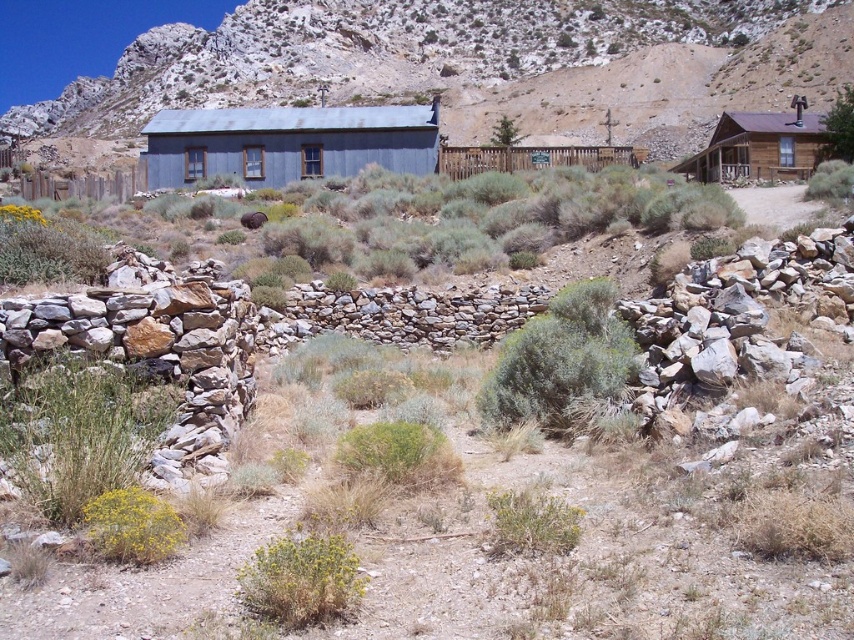
Can you confirm if brown wooden cabin at upper right is shorter than yellow-green shrub at lower left?

In fact, brown wooden cabin at upper right may be taller than yellow-green shrub at lower left.

Which is above, brown wooden cabin at upper right or yellow-green shrub at lower left?

Positioned higher is brown wooden cabin at upper right.

Is point (686, 161) less distant than point (164, 520)?

No.

Find the location of a particular element. The height and width of the screenshot is (640, 854). brown wooden cabin at upper right is located at coordinates (759, 147).

Who is positioned more to the right, green shrub at center or green leafy bush at upper right?

From the viewer's perspective, green leafy bush at upper right appears more on the right side.

Is green shrub at center positioned before green leafy bush at upper right?

That is True.

Who is more distant from viewer, (x=32, y=257) or (x=845, y=90)?

The point (x=845, y=90) is more distant.

Locate an element on the screen. green shrub at center is located at coordinates (47, 248).

Can you confirm if blue corrugated metal cabin at center is positioned above brown wooden cabin at upper right?

Yes, blue corrugated metal cabin at center is above brown wooden cabin at upper right.

Which is below, blue corrugated metal cabin at center or brown wooden cabin at upper right?

brown wooden cabin at upper right is lower down.

Which is in front, point (299, 134) or point (741, 145)?

Point (741, 145) is more forward.

Where is `blue corrugated metal cabin at center`? blue corrugated metal cabin at center is located at coordinates (287, 141).